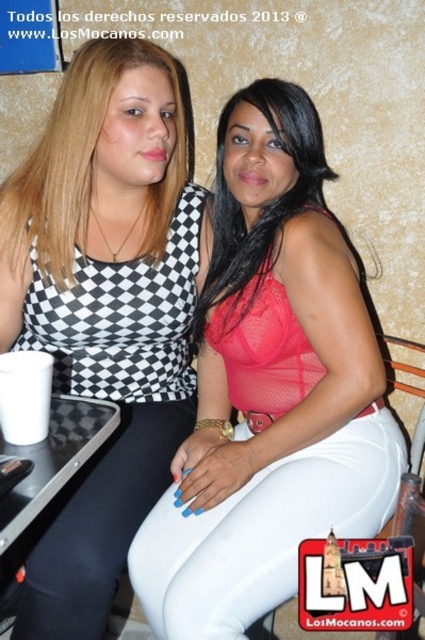
Question: Is black checkered tank top at upper left to the left of white paper cup at left from the viewer's perspective?

Choices:
 (A) yes
 (B) no

Answer: (B)

Question: Which of the following is the closest to the observer?

Choices:
 (A) black checkered tank top at upper left
 (B) matte red blouse at center
 (C) pink mesh top at center

Answer: (C)

Question: Among these points, which one is farthest from the camera?

Choices:
 (A) (295, 168)
 (B) (167, 436)
 (C) (217, 140)
 (D) (42, 392)

Answer: (C)

Question: Which point is farther from the camera taking this photo?

Choices:
 (A) (215, 481)
 (B) (105, 564)

Answer: (A)

Question: Can you confirm if black checkered tank top at upper left is bigger than white paper cup at left?

Choices:
 (A) no
 (B) yes

Answer: (B)

Question: Is pink mesh top at center positioned at the back of matte red blouse at center?

Choices:
 (A) yes
 (B) no

Answer: (B)